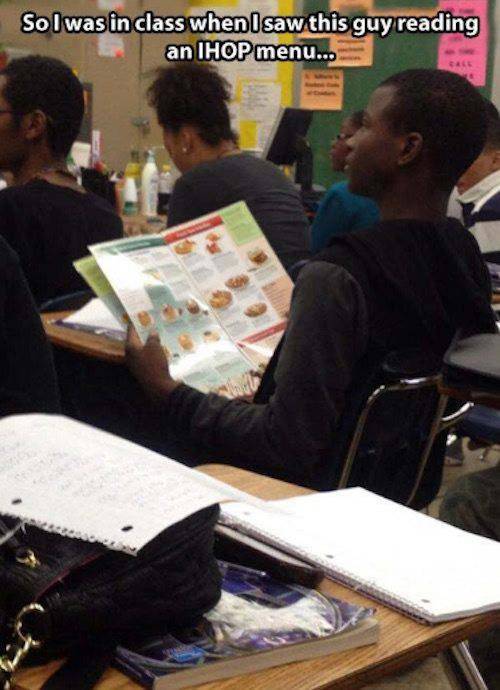
Where is `papers with writing hanging on walls`? The height and width of the screenshot is (690, 500). papers with writing hanging on walls is located at coordinates (319, 95), (344, 36), (453, 43), (305, 32), (109, 43), (114, 1), (260, 97).